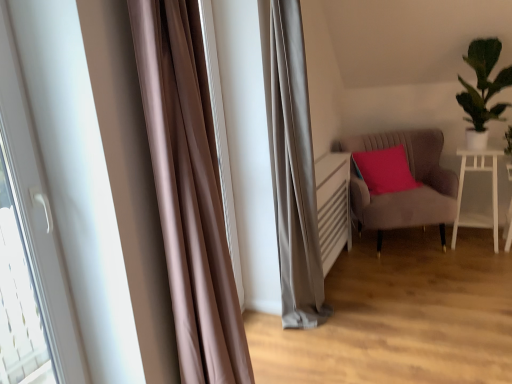
What are the coordinates of `vacant region under suede-like beige armchair at right (from a real-world perspective)` in the screenshot? It's located at (403, 245).